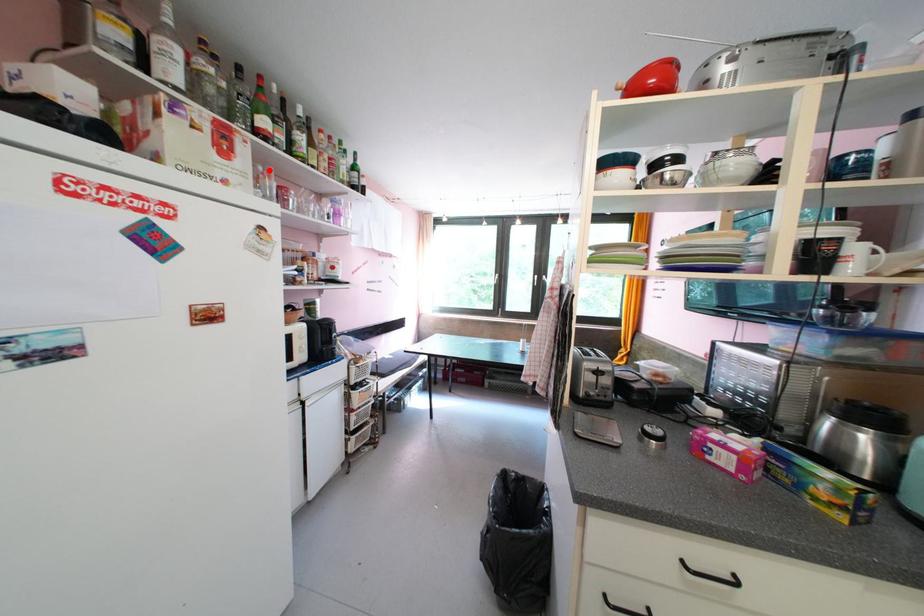
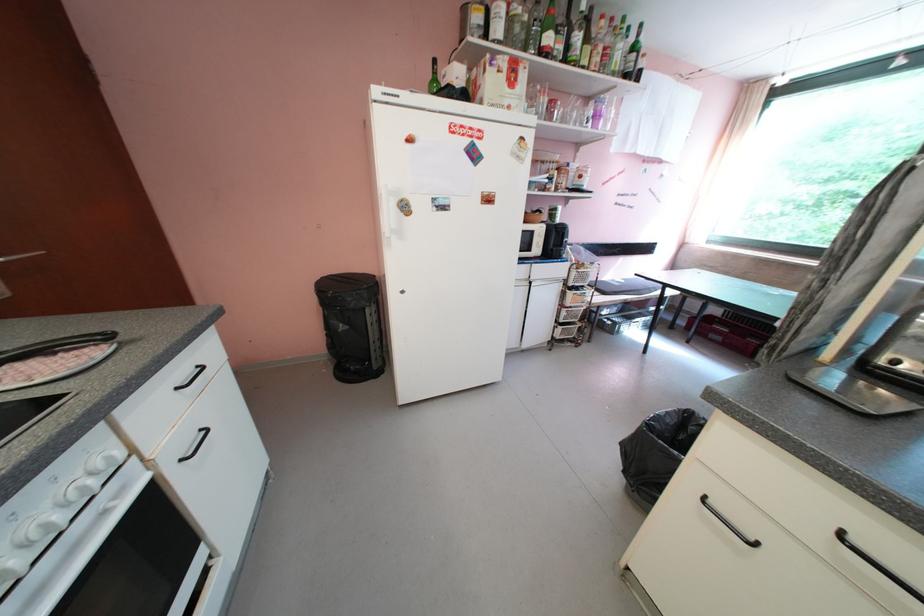
In the second image, find the point that corresponds to the highlighted location in the first image.

(546, 90)